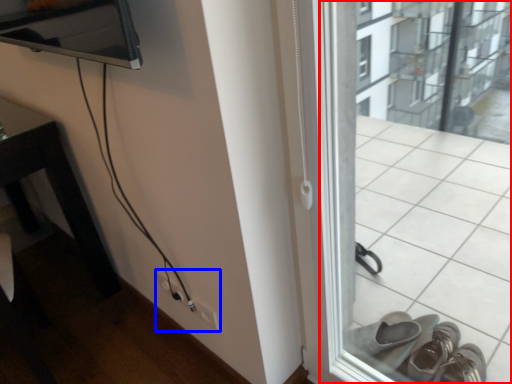
Question: Which point is closer to the camera, window frame (highlighted by a red box) or electric outlet (highlighted by a blue box)?

Choices:
 (A) window frame
 (B) electric outlet

Answer: (A)